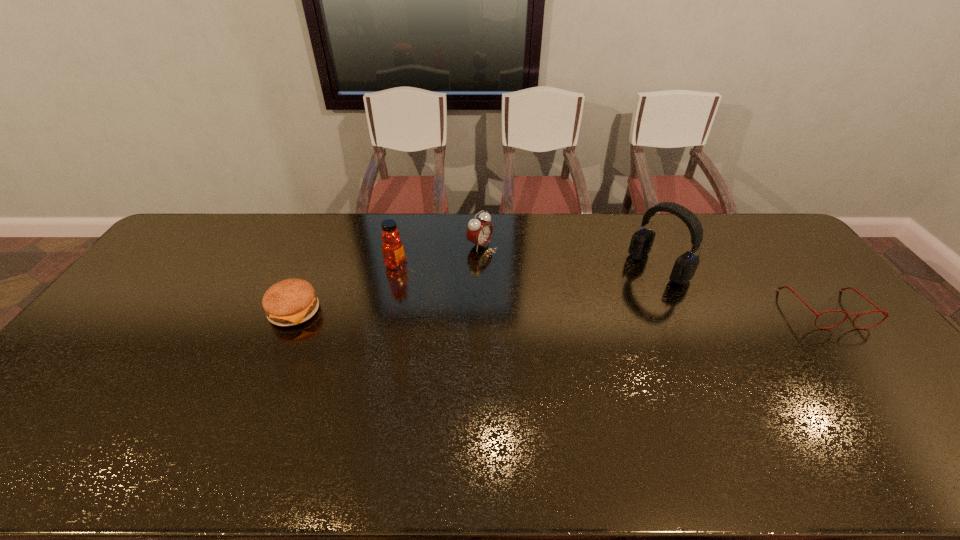
Where is `vacant space situated 0.210m on the face of the rightmost object`? The height and width of the screenshot is (540, 960). vacant space situated 0.210m on the face of the rightmost object is located at coordinates (893, 393).

This screenshot has width=960, height=540. Find the location of `free region located 0.340m on the headband of the headset`. free region located 0.340m on the headband of the headset is located at coordinates (567, 330).

You are a GUI agent. You are given a task and a screenshot of the screen. Output one action in this format:
    pyautogui.click(x=<x>, y=<y>)
    Task: Click on the vacant region located 0.210m on the headband of the headset
    This screenshot has width=960, height=540.
    Given the screenshot: What is the action you would take?
    pyautogui.click(x=598, y=309)

At what (x,y) coordinates should I click in order to perform the action: click on free region located 0.200m on the headband of the headset. Please return your answer as a coordinate pair (x, y). This screenshot has height=540, width=960. Looking at the image, I should click on (600, 308).

The height and width of the screenshot is (540, 960). I want to click on vacant space situated on the front label of the second tallest object, so click(x=472, y=302).

The height and width of the screenshot is (540, 960). I want to click on blank area located on the front label of the second tallest object, so click(x=497, y=315).

Image resolution: width=960 pixels, height=540 pixels. What are the coordinates of `vacant region located on the front label of the second tallest object` in the screenshot? It's located at (416, 274).

I want to click on vacant area located on the clock face of the alarm clock, so click(x=517, y=266).

The width and height of the screenshot is (960, 540). In order to click on free spot located on the clock face of the alarm clock in this screenshot , I will do pyautogui.click(x=561, y=289).

The image size is (960, 540). Identify the location of vacant space located on the clock face of the alarm clock. tap(527, 271).